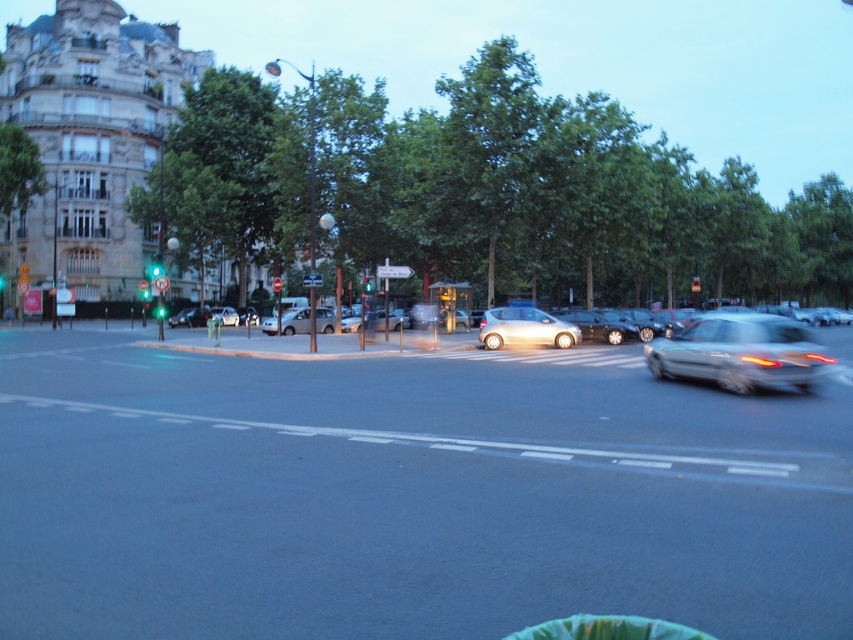
Question: Considering the relative positions of satin silver car at center and green glass traffic light at center in the image provided, where is satin silver car at center located with respect to green glass traffic light at center?

Choices:
 (A) right
 (B) left

Answer: (A)

Question: Which point is farther from the camera taking this photo?

Choices:
 (A) 715,220
 (B) 689,369
 (C) 492,326

Answer: (A)

Question: Is silver metallic car at right behind green glass traffic light at upper center?

Choices:
 (A) no
 (B) yes

Answer: (A)

Question: Estimate the real-world distances between objects in this image. Which object is farther from the green glass traffic light at upper center?

Choices:
 (A) silver metallic car at right
 (B) green glass traffic light at center
 (C) satin silver car at center
 (D) green leafy tree at upper center

Answer: (D)

Question: Does satin silver car at center appear over green glass traffic light at upper center?

Choices:
 (A) no
 (B) yes

Answer: (A)

Question: Based on their relative distances, which object is farther from the green glass traffic light at upper center?

Choices:
 (A) silver metallic car at right
 (B) satin silver car at center

Answer: (A)